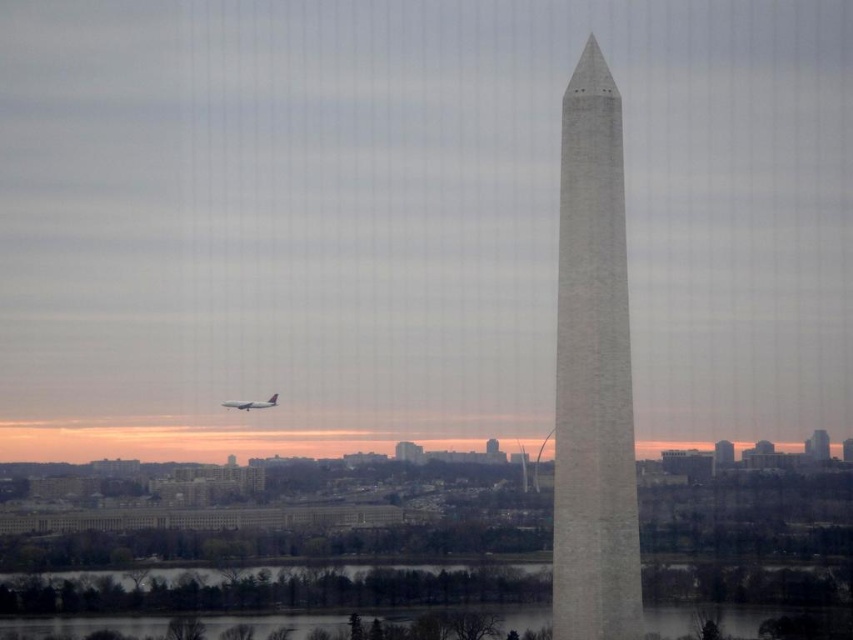
You are standing at the point marked by coordinates point (593, 372) in the image. What structure are you facing?

The point (593, 372) indicates the white stone tower at center, so you are facing the white stone tower at center.

You are a tourist standing in front of the white stone tower at center and looking towards the metallic silver airplane at lower left. Which object is closer to you based on their positions in the image?

The metallic silver airplane at lower left is closer to you because it is positioned under the white stone tower at center, indicating it is in the foreground of the image.